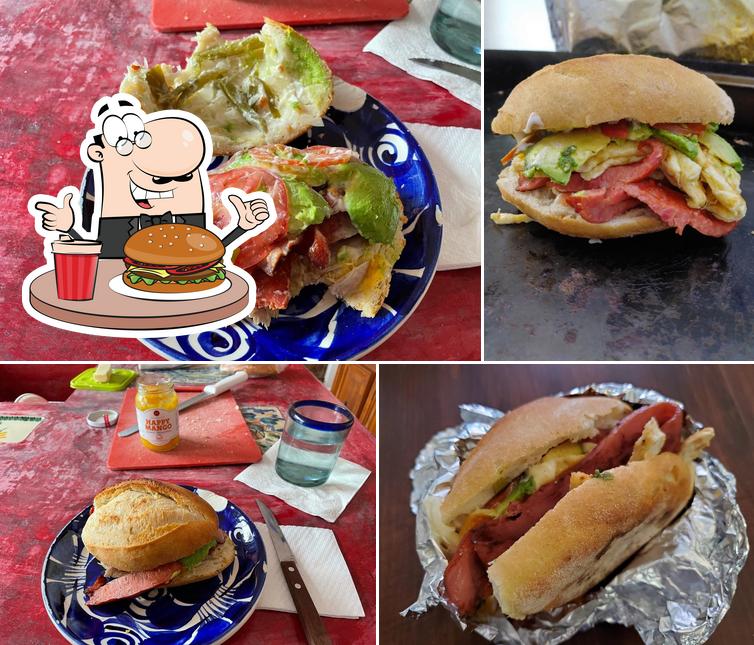
What are the coordinates of `plate` in the screenshot? It's located at (219, 597), (393, 279).